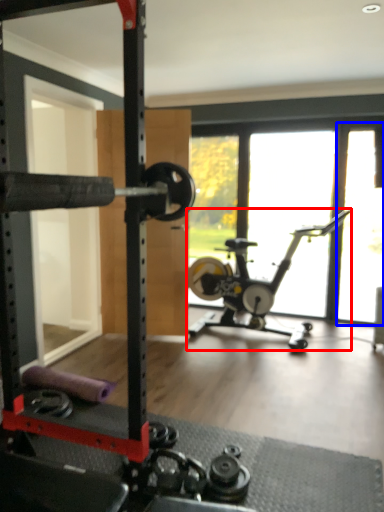
Question: Which point is closer to the camera, stationary bicycle (highlighted by a red box) or window screen (highlighted by a blue box)?

Choices:
 (A) stationary bicycle
 (B) window screen

Answer: (A)